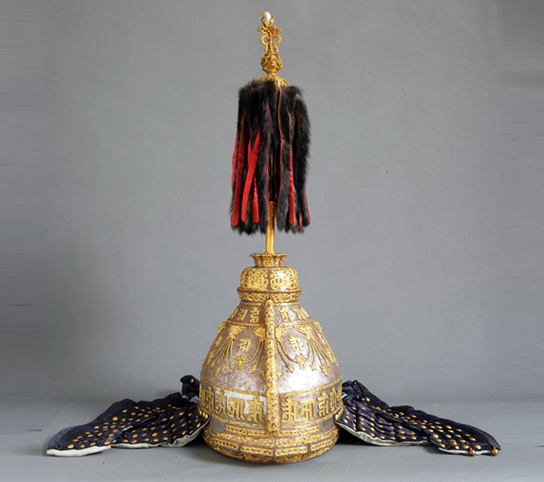
In order to click on floor in this screenshot , I will do `click(36, 430)`.